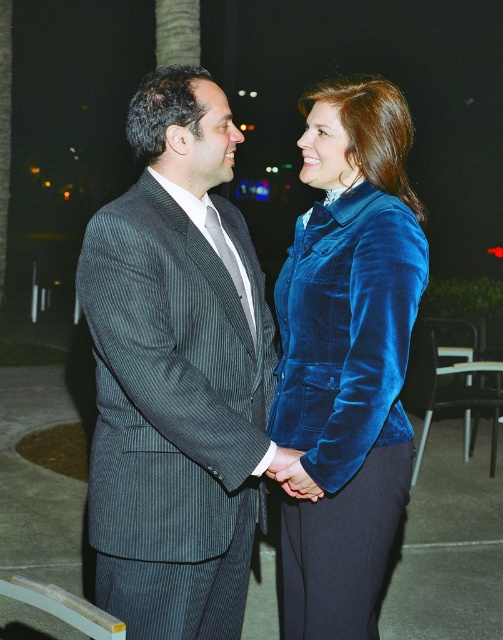
You are a photographer trying to capture a closeup shot of both the pinstriped suit at center and the velvet blue jacket at center in the scene. Your camera has a minimum focus distance of 12 inches. Can you focus on both subjects simultaneously without moving the camera?

The pinstriped suit at center and velvet blue jacket at center are 12.13 inches apart. Since the distance between them is slightly over 12 inches, the camera can focus on both subjects as the separation is within the minimum focus distance requirement.

You are a photographer trying to capture a closeup shot of the man on the left and the woman on the right. You have a camera with a 50mm lens that can focus on objects up to 2 meters away. If point A is at coordinates point (113, 307) and point B is at coordinates point (294, 480), which point should you focus on to ensure the man on the left is in focus?

You should focus on point A at coordinates point (113, 307) because it is closer to the viewer than point B at coordinates point (294, 480), ensuring the man on the left is in focus.

You are a photographer trying to capture a candid shot of both the pinstriped suit at center and the velvet blue jacket at center in the image. Since you want to ensure both are visible in the frame, which clothing item should you focus on to avoid cropping out either?

The pinstriped suit at center occupies less space than the velvet blue jacket at center, so focusing on the velvet blue jacket at center ensures both are visible since it is larger and can help frame the shot to include the smaller pinstriped suit at center.